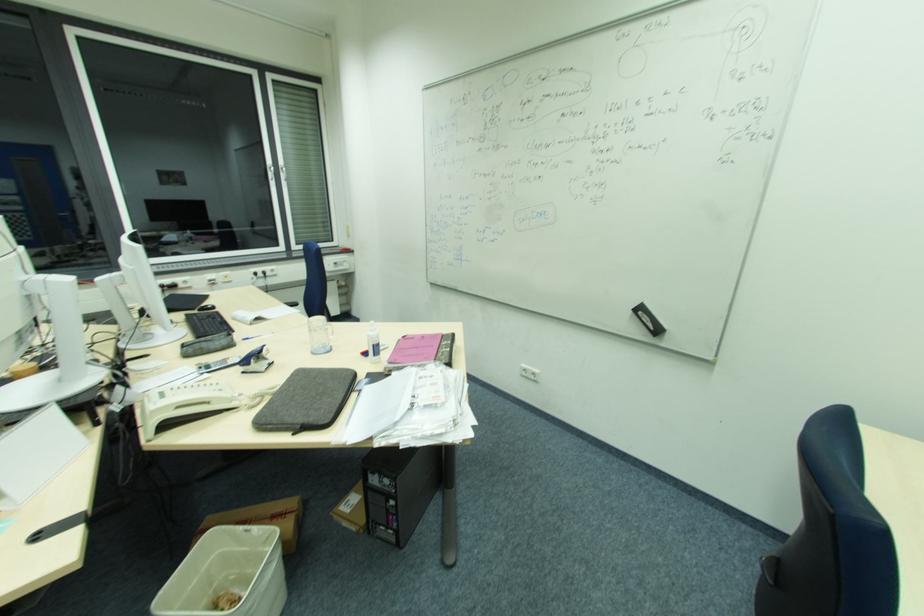
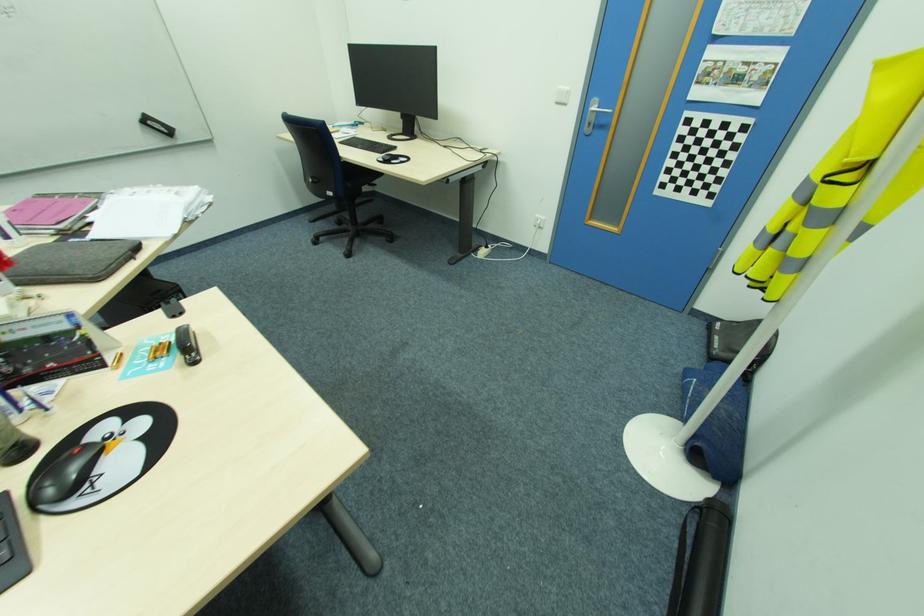
The point at (643, 314) is marked in the first image. Where is the corresponding point in the second image?

(151, 123)